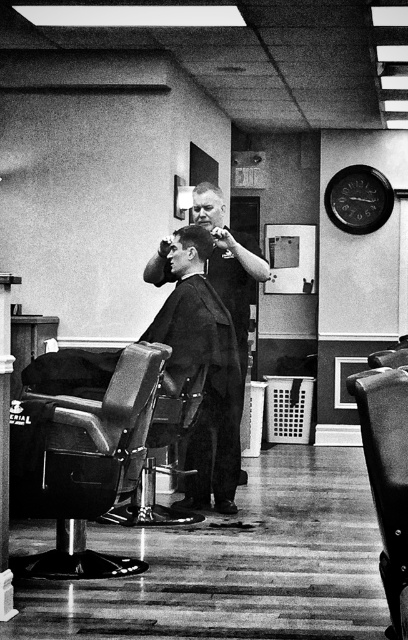
You are a customer in a barbershop and want to know which hairstyle is taller between the short dark hair at center and the short curly hair at center. Can you tell me?

The short dark hair at center has a greater height compared to the short curly hair at center, so the short dark hair at center is taller.

You are a customer entering the barbershop and want to sit on the smooth black barber chair at center. However, you have a short dark hair at center. Will your hair interfere with sitting comfortably on the chair?

The short dark hair at center is likely not wide enough to interfere with sitting comfortably on the smooth black barber chair at center since the chair is wider.

You are standing at the entrance of the barbershop. You want to sit in the smooth black barber chair at center. Which direction should you walk to reach it?

You should walk towards the center of the barbershop to reach the smooth black barber chair at center.